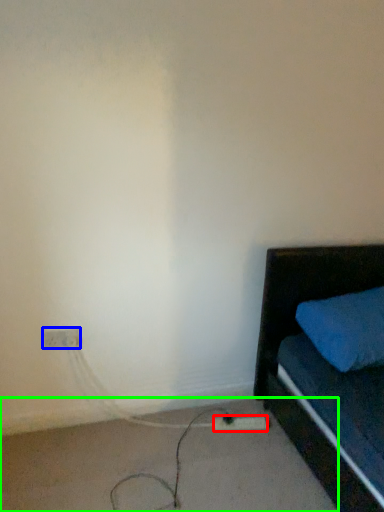
Question: Which object is positioned farthest from extension cord (highlighted by a red box)? Select from electric outlet (highlighted by a blue box) and concrete (highlighted by a green box).

Choices:
 (A) electric outlet
 (B) concrete

Answer: (A)